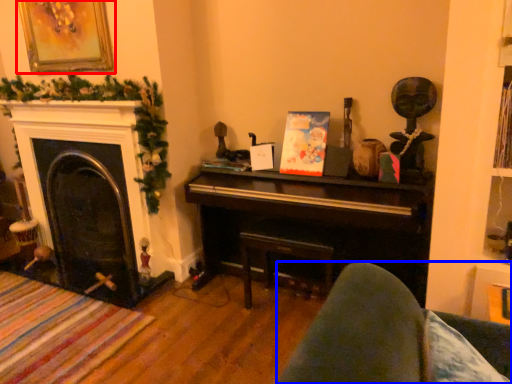
Question: Which point is closer to the camera, picture frame (highlighted by a red box) or rocking chair (highlighted by a blue box)?

Choices:
 (A) picture frame
 (B) rocking chair

Answer: (B)